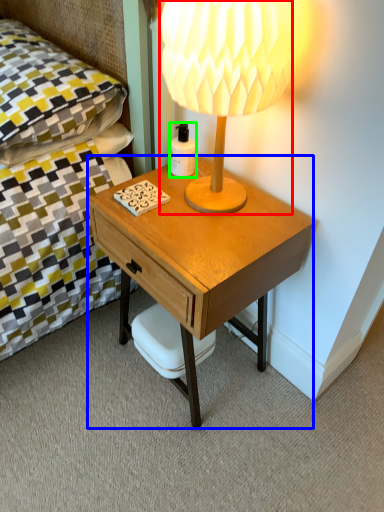
Question: Which is farther away from lamp (highlighted by a red box)? desk (highlighted by a blue box) or bottle (highlighted by a green box)?

Choices:
 (A) desk
 (B) bottle

Answer: (B)